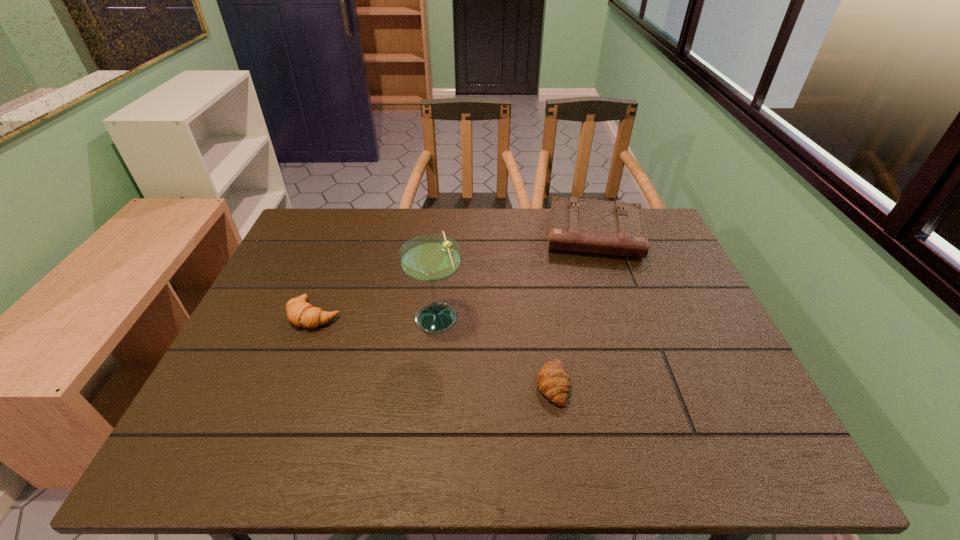
In order to click on free space located 0.370m on the back of the leftmost object in this screenshot , I will do `click(351, 222)`.

Where is `blank area located 0.270m on the left of the nearest object`? This screenshot has height=540, width=960. blank area located 0.270m on the left of the nearest object is located at coordinates (416, 384).

Where is `object that is at the far edge`? This screenshot has width=960, height=540. object that is at the far edge is located at coordinates (616, 228).

Find the location of a particular element. This screenshot has height=540, width=960. object that is at the left edge is located at coordinates (302, 314).

I want to click on object that is at the right edge, so click(616, 228).

You are a GUI agent. You are given a task and a screenshot of the screen. Output one action in this format:
    pyautogui.click(x=<x>, y=<y>)
    Task: Click on the object that is at the far right corner
    
    Given the screenshot: What is the action you would take?
    pyautogui.click(x=616, y=228)

I want to click on vacant space at the far edge of the desktop, so click(x=488, y=217).

In the image, there is a desktop. At what (x,y) coordinates should I click in order to perform the action: click on free space at the near edge. Please return your answer as a coordinate pair (x, y). The height and width of the screenshot is (540, 960). Looking at the image, I should click on (353, 440).

Where is `vacant region at the left edge`? The image size is (960, 540). vacant region at the left edge is located at coordinates (284, 363).

You are a GUI agent. You are given a task and a screenshot of the screen. Output one action in this format:
    pyautogui.click(x=<x>, y=<y>)
    Task: Click on the free location at the right edge
    
    Given the screenshot: What is the action you would take?
    pyautogui.click(x=684, y=306)